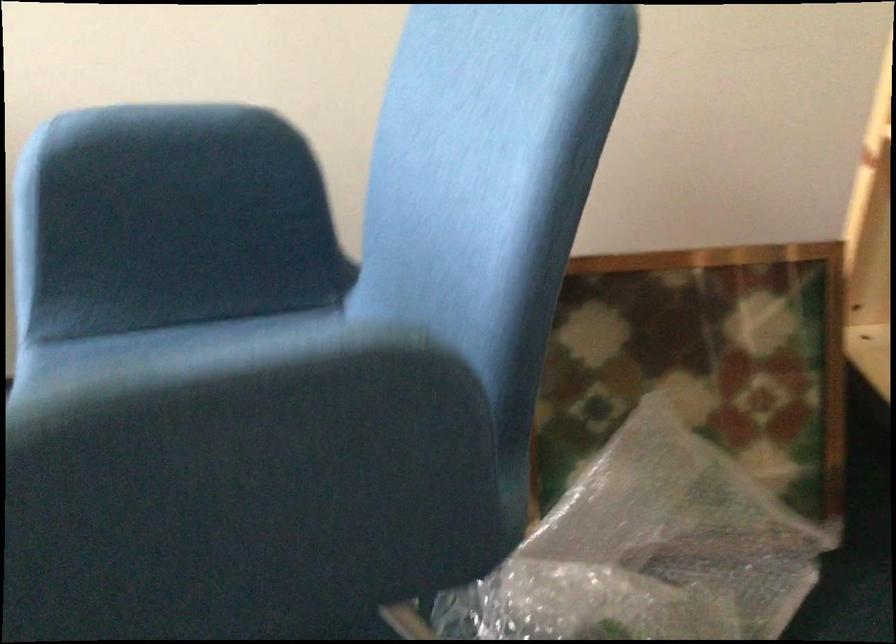
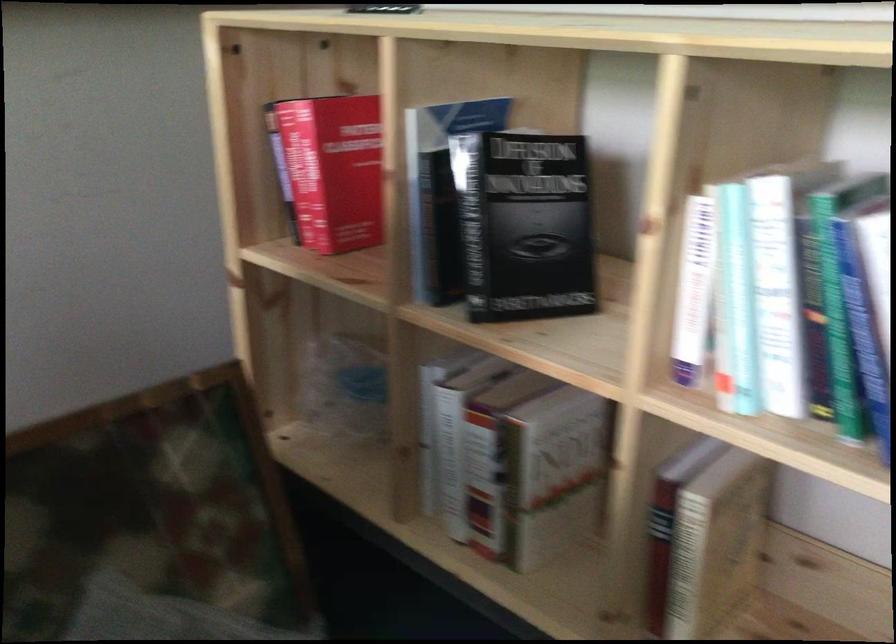
Question: The camera is either moving clockwise (left) or counter-clockwise (right) around the object. The first image is from the beginning of the video and the second image is from the end. Is the camera moving left or right when shooting the video?

Choices:
 (A) Left
 (B) Right

Answer: (A)